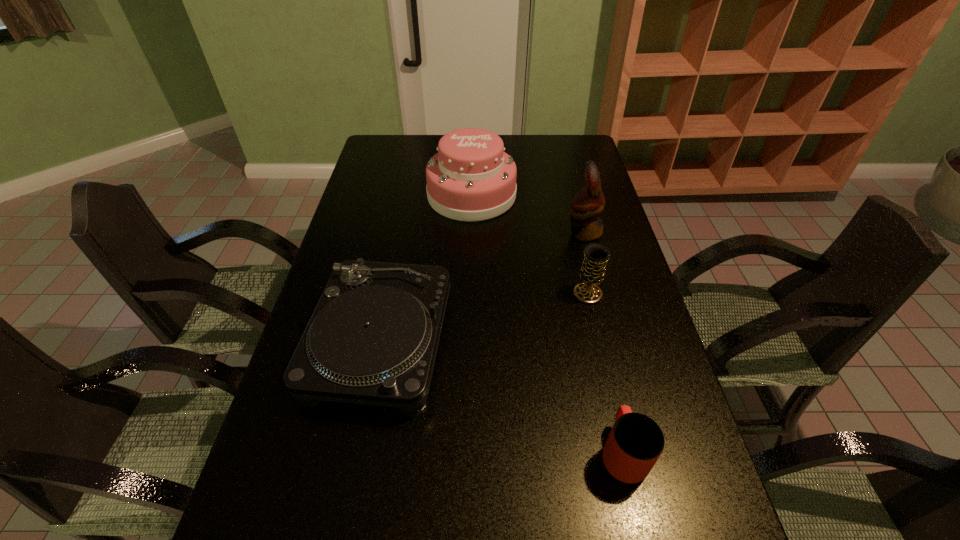
Identify the location of free space between the chalice and the record player. This screenshot has height=540, width=960. (484, 318).

Identify which object is located as the third nearest to the record player. Please provide its 2D coordinates. Your answer should be formatted as a tuple, i.e. [(x, y)], where the tuple contains the x and y coordinates of a point satisfying the conditions above.

[(596, 255)]

Locate which object ranks fourth in proximity to the chalice. Please provide its 2D coordinates. Your answer should be formatted as a tuple, i.e. [(x, y)], where the tuple contains the x and y coordinates of a point satisfying the conditions above.

[(635, 443)]

The image size is (960, 540). I want to click on free space that satisfies the following two spatial constraints: 1. on the front side of the chalice; 2. on the right side of the farthest object, so click(x=469, y=294).

I want to click on free space that satisfies the following two spatial constraints: 1. on the back side of the record player; 2. on the right side of the chalice, so click(390, 294).

This screenshot has height=540, width=960. What are the coordinates of `free location that satisfies the following two spatial constraints: 1. on the back side of the record player; 2. on the left side of the chalice` in the screenshot? It's located at (390, 294).